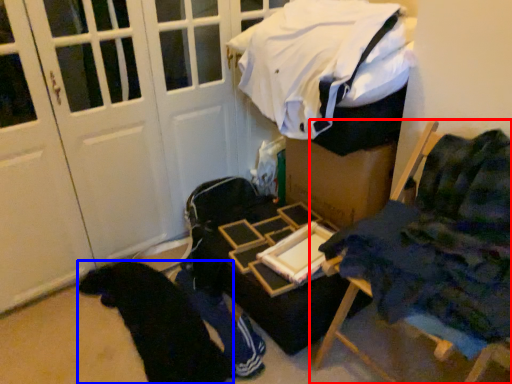
Question: Which of the following is the closest to the observer, furniture (highlighted by a red box) or clothing (highlighted by a blue box)?

Choices:
 (A) furniture
 (B) clothing

Answer: (A)